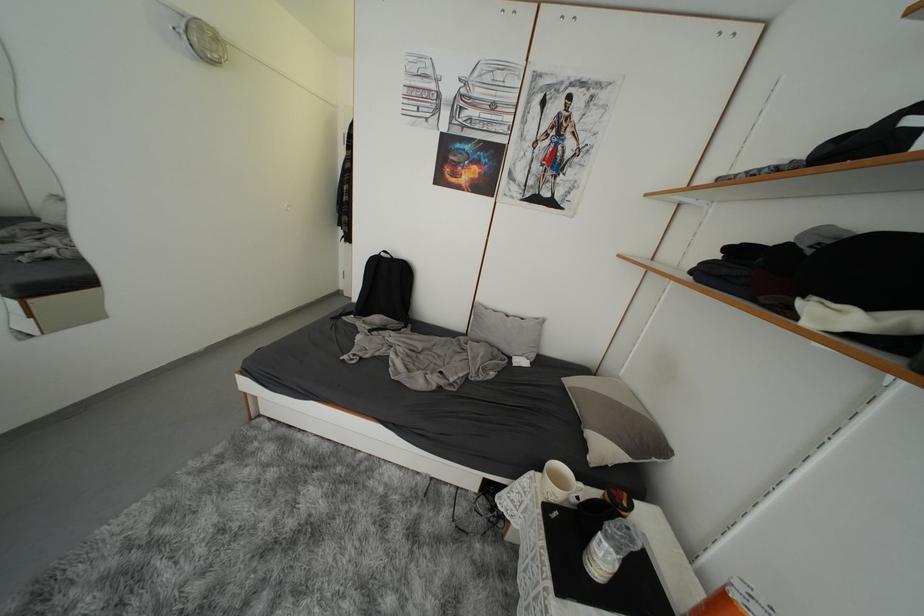
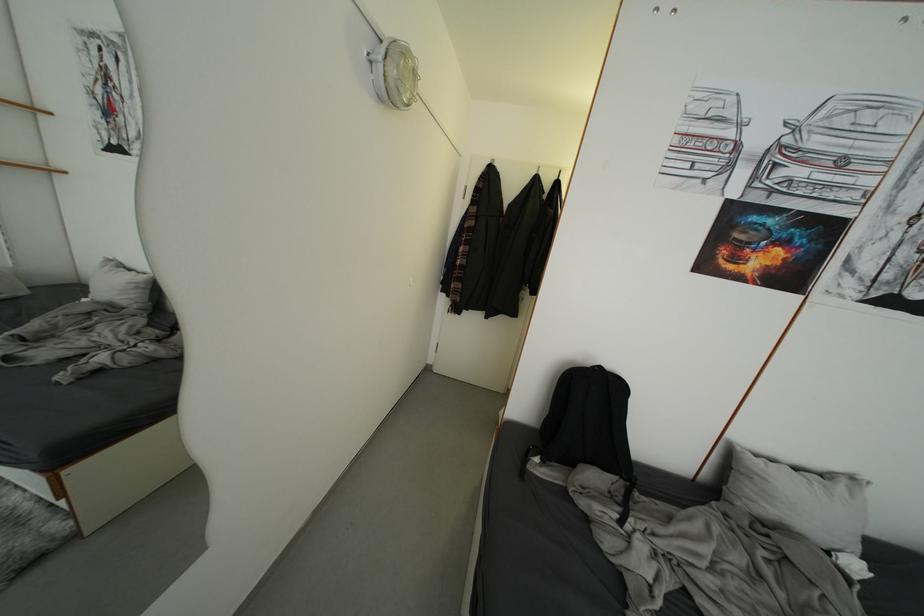
In a continuous first-person perspective shot, in which direction is the camera moving?

The cameraman moved toward left, forward.